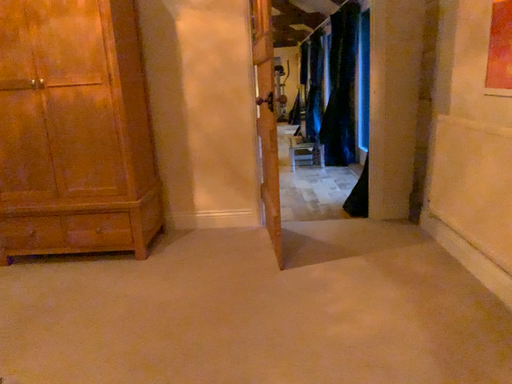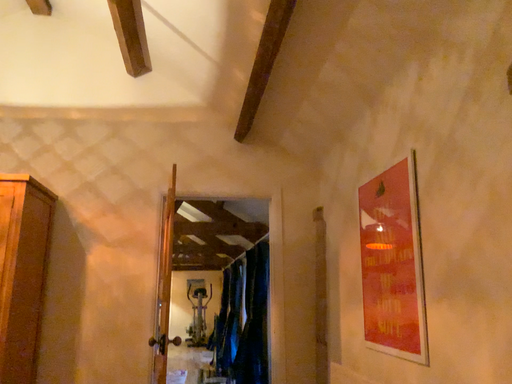
Question: How did the camera likely rotate when shooting the video?

Choices:
 (A) rotated upward
 (B) rotated downward

Answer: (A)